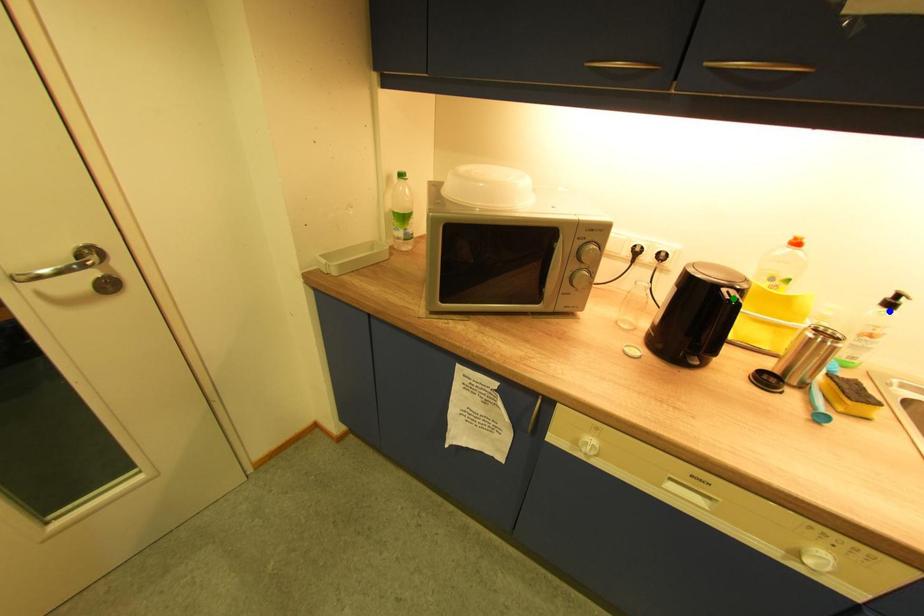
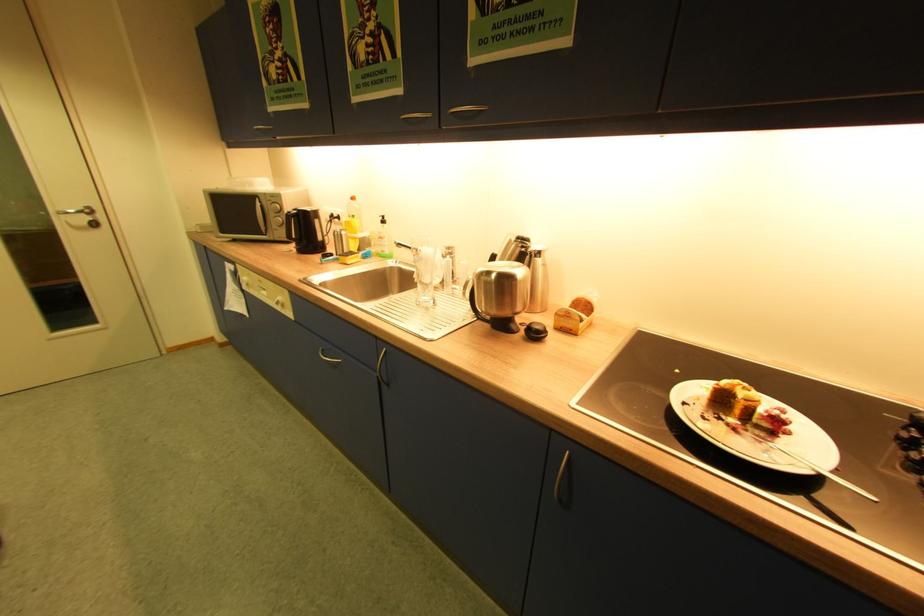
I am providing you with two images of the same scene from different viewpoints. Three points are marked in image1. Which point corresponds to a part or object that is occluded in image2?In image1, three points are marked. Which of them correspond to a part or object that is occluded in image2?Among the three points shown in image1, which one corresponds to a part or object that is no longer visible due to occlusion in image2?

Invisible in image2: yellow point.